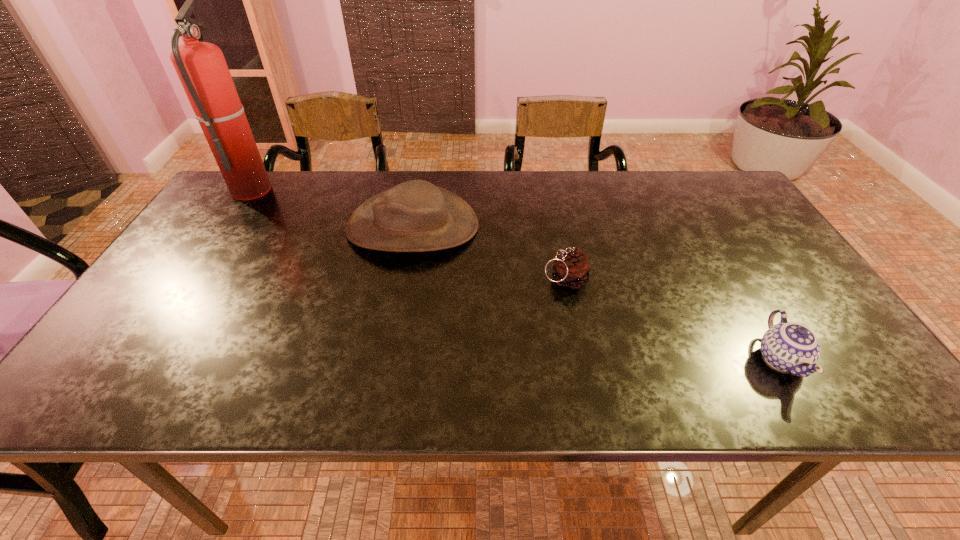
The height and width of the screenshot is (540, 960). I want to click on free point at the near edge, so click(405, 375).

In the image, there is a desktop. At what (x,y) coordinates should I click in order to perform the action: click on vacant space at the left edge. Please return your answer as a coordinate pair (x, y). The image size is (960, 540). Looking at the image, I should click on (228, 248).

In the image, there is a desktop. Identify the location of vacant space at the right edge. (819, 302).

Where is `vacant space at the far right corner`? vacant space at the far right corner is located at coordinates (709, 200).

Locate an element on the screen. vacant space that is in between the pinecone and the rightmost object is located at coordinates (673, 320).

What are the coordinates of `free spot between the rightmost object and the pinecone` in the screenshot? It's located at (673, 320).

This screenshot has height=540, width=960. In order to click on vacant area that lies between the fire extinguisher and the cowboy hat in this screenshot , I will do `click(332, 207)`.

Locate an element on the screen. This screenshot has width=960, height=540. vacant point located between the nearest object and the fire extinguisher is located at coordinates (516, 274).

Find the location of a particular element. free space between the leftmost object and the nearest object is located at coordinates (516, 274).

You are a GUI agent. You are given a task and a screenshot of the screen. Output one action in this format:
    pyautogui.click(x=<x>, y=<y>)
    Task: Click on the free spot between the rightmost object and the third farthest object
    The image size is (960, 540).
    Given the screenshot: What is the action you would take?
    pyautogui.click(x=673, y=320)